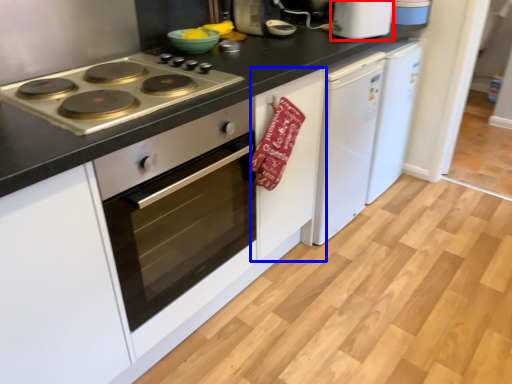
Question: Which point is closer to the camera, kitchen appliance (highlighted by a red box) or cabinetry (highlighted by a blue box)?

Choices:
 (A) kitchen appliance
 (B) cabinetry

Answer: (B)